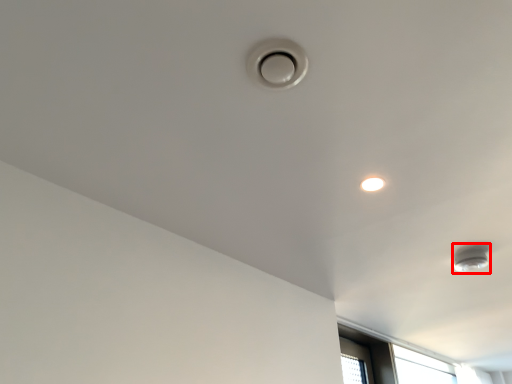
Question: From the image, what is the correct spatial relationship of lamp (annotated by the red box) in relation to droplight?

Choices:
 (A) right
 (B) left

Answer: (A)